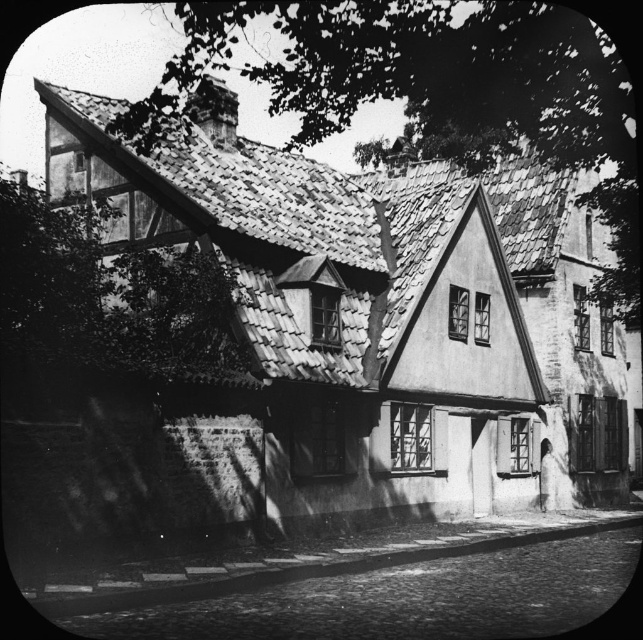
Is green leafy tree at upper center wider than green leafy tree at upper left?

Yes, green leafy tree at upper center is wider than green leafy tree at upper left.

Which is more to the right, green leafy tree at upper center or green leafy tree at upper left?

green leafy tree at upper center

Which is in front, point (595, 282) or point (41, 356)?

Point (41, 356) is more forward.

Find the location of a particular element. The width and height of the screenshot is (643, 640). green leafy tree at upper center is located at coordinates (431, 88).